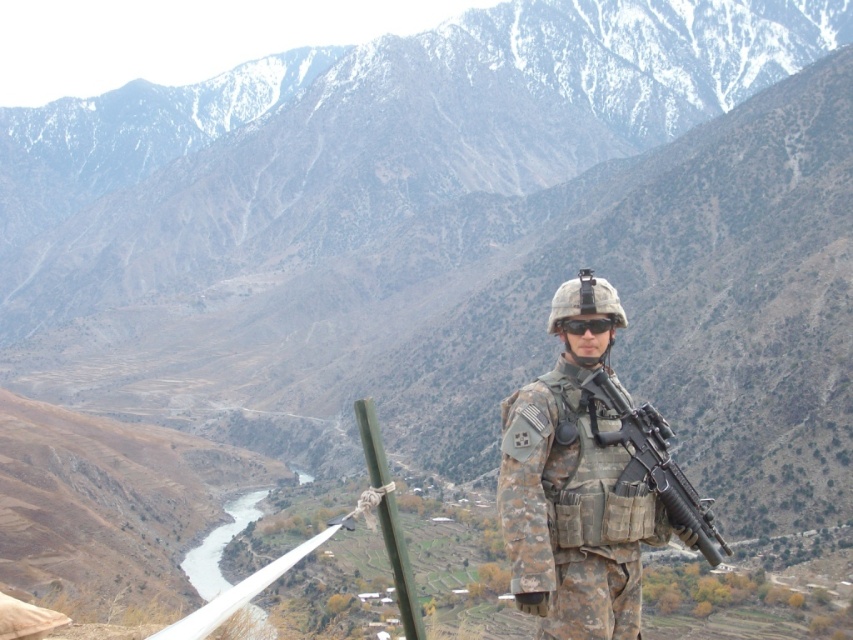
Is camouflage uniform at center below matte black rifle at center?

Answer: No.

This screenshot has width=853, height=640. In order to click on camouflage uniform at center in this screenshot , I will do `click(589, 483)`.

Is matte black rifle at center shorter than black matte goggles at center?

Incorrect, matte black rifle at center's height does not fall short of black matte goggles at center's.

Is matte black rifle at center in front of black matte goggles at center?

That is True.

The image size is (853, 640). Describe the element at coordinates (651, 461) in the screenshot. I see `matte black rifle at center` at that location.

The image size is (853, 640). Find the location of `matte black rifle at center`. matte black rifle at center is located at coordinates (651, 461).

Does camouflage uniform at center appear on the left side of black matte goggles at center?

No, camouflage uniform at center is not to the left of black matte goggles at center.

From the picture: Between camouflage uniform at center and black matte goggles at center, which one has more height?

camouflage uniform at center is taller.

You are a GUI agent. You are given a task and a screenshot of the screen. Output one action in this format:
    pyautogui.click(x=<x>, y=<y>)
    Task: Click on the camouflage uniform at center
    This screenshot has width=853, height=640.
    Given the screenshot: What is the action you would take?
    pyautogui.click(x=589, y=483)

Find the location of a particular element. camouflage uniform at center is located at coordinates (589, 483).